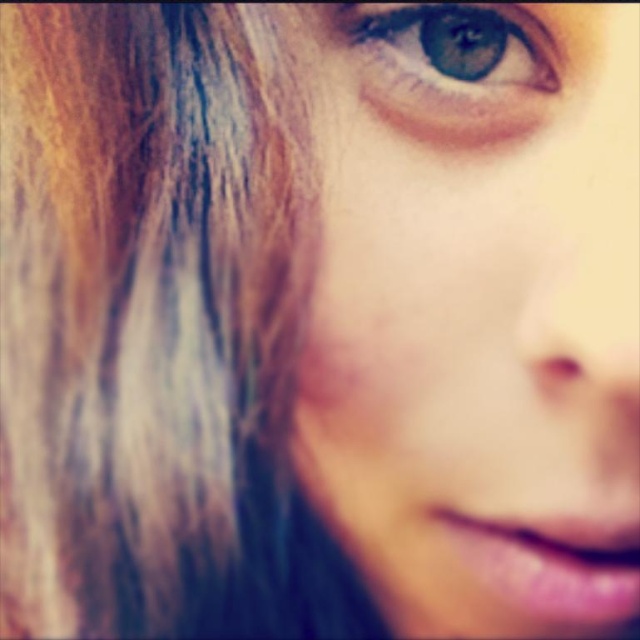
Consider the image. Looking at the portrait, where is the shiny brown hair at left in relation to the smooth skin face at upper right?

The shiny brown hair at left is located to the left of the smooth skin face at upper right.

Based on the scene description, can you determine the spatial relationship between the shiny brown hair at left and the blue glossy eye at upper center?

The shiny brown hair at left is located below the blue glossy eye at upper center.

You are a photographer adjusting the focus on a camera. The subject has a smooth skin face at upper right and a blue glossy eye at upper center. The camera can only focus on one object at a time. Which object should you focus on to ensure the closest one is sharp?

The smooth skin face at upper right and blue glossy eye at upper center are 2.05 inches apart. Since the camera can only focus on one object at a time, you should focus on the blue glossy eye at upper center because it is closer to the camera than the smooth skin face at upper right.